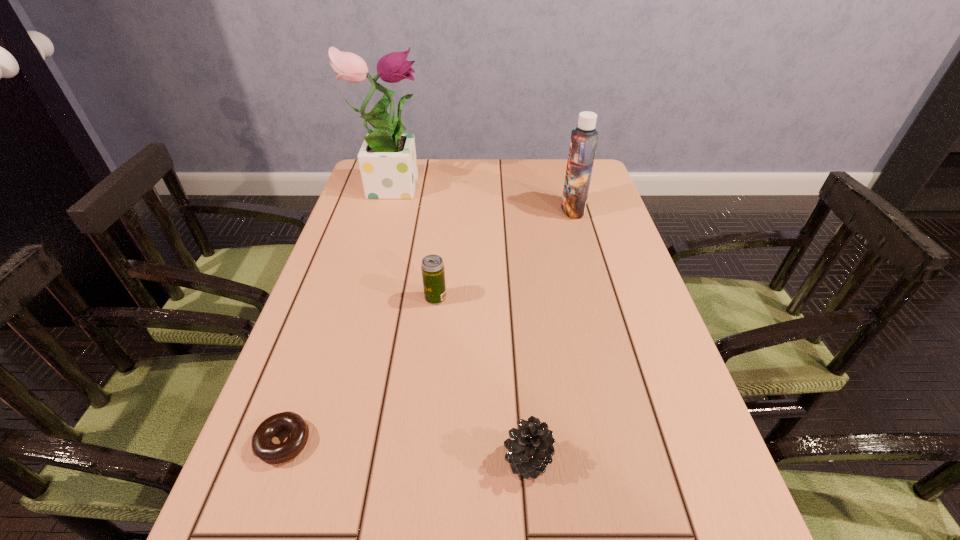
Find the location of a particular element. vacant area located 0.230m on the front label of the fourth shortest object is located at coordinates (485, 209).

Find the location of a particular element. vacant space located on the back of the beer can is located at coordinates (442, 241).

Locate an element on the screen. vacant space located 0.280m on the right of the pinecone is located at coordinates (716, 459).

Find the location of a particular element. The image size is (960, 540). vacant region located 0.100m on the front of the shortest object is located at coordinates (252, 532).

Where is `object that is at the far edge`? This screenshot has height=540, width=960. object that is at the far edge is located at coordinates (387, 159).

Identify the location of flower arrangement that is at the left edge. (387, 159).

Identify the location of doughnut that is at the left edge. This screenshot has height=540, width=960. (262, 446).

Identify the location of object located at the right edge. This screenshot has height=540, width=960. (583, 142).

You are a GUI agent. You are given a task and a screenshot of the screen. Output one action in this format:
    pyautogui.click(x=<x>, y=<y>)
    Task: Click on the object at the far left corner
    This screenshot has height=540, width=960.
    Given the screenshot: What is the action you would take?
    pyautogui.click(x=387, y=159)

Locate an element on the screen. The image size is (960, 540). vacant space at the far edge of the desktop is located at coordinates (430, 161).